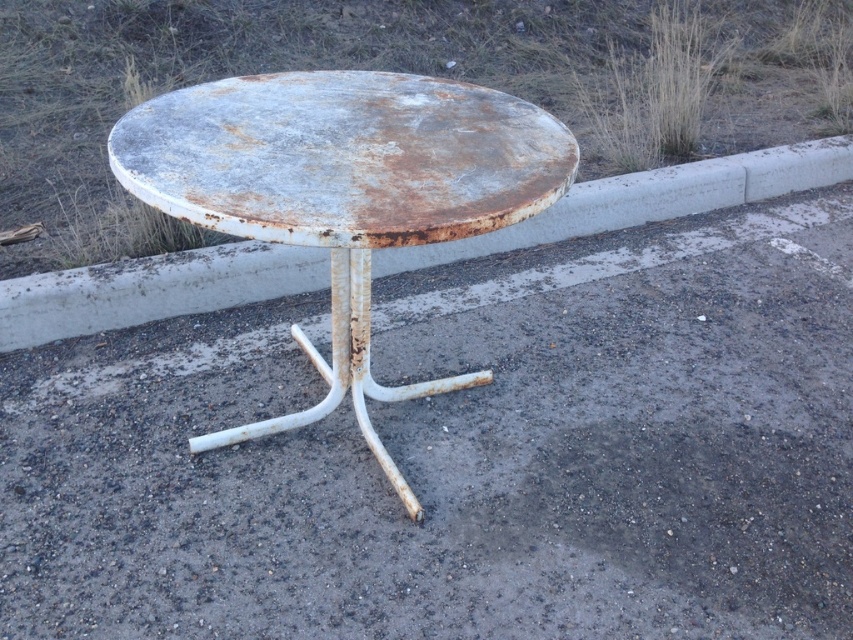
Can you confirm if rusty metal table at center is positioned to the right of concrete curb at center?

No, rusty metal table at center is not to the right of concrete curb at center.

Does rusty metal table at center appear under concrete curb at center?

Yes.

The image size is (853, 640). Identify the location of rusty metal table at center. [344, 192].

What are the coordinates of `rusty metal table at center` in the screenshot? It's located at (344, 192).